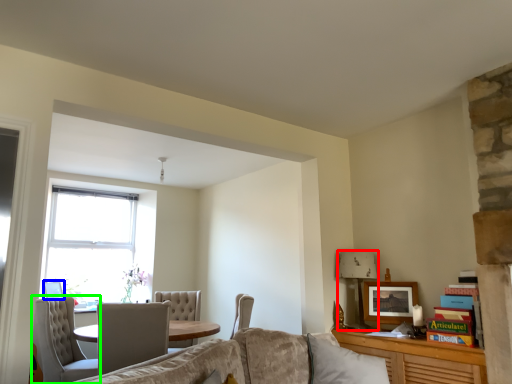
Question: Considering the real-world distances, which object is farthest from lamp (highlighted by a red box)? picture frame (highlighted by a blue box) or chair (highlighted by a green box)?

Choices:
 (A) picture frame
 (B) chair

Answer: (A)